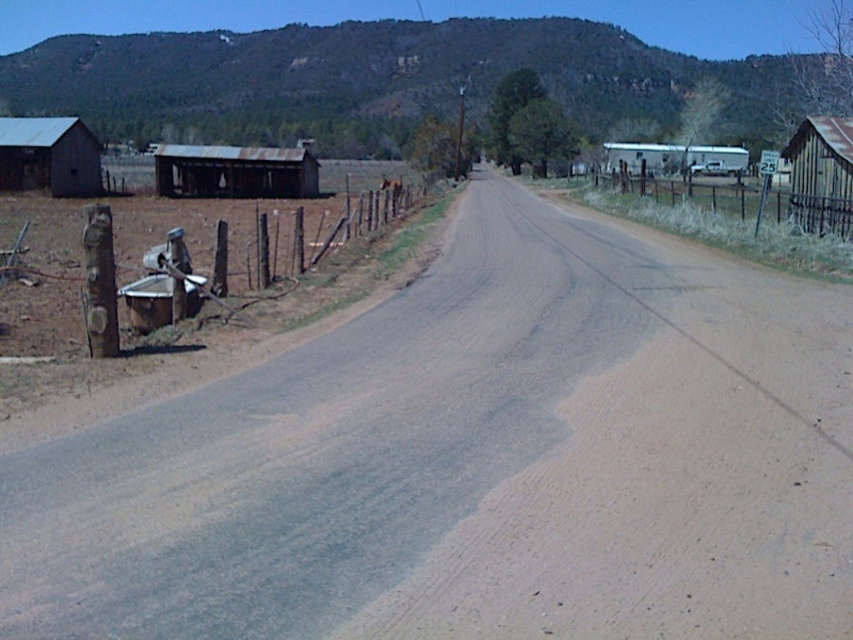
Is rusty metal fence at right shorter than rusty corrugated metal hut at right?

Correct, rusty metal fence at right is not as tall as rusty corrugated metal hut at right.

This screenshot has width=853, height=640. What do you see at coordinates (717, 209) in the screenshot? I see `rusty metal fence at right` at bounding box center [717, 209].

Where is `rusty metal fence at right`? This screenshot has width=853, height=640. rusty metal fence at right is located at coordinates (717, 209).

Identify the location of rusty metal fence at right. The width and height of the screenshot is (853, 640). (717, 209).

Is point (724, 128) closer to viewer compared to point (358, 225)?

No, (724, 128) is behind (358, 225).

Identify the location of green grassy hill at upper center. (392, 81).

Does green grassy hill at upper center have a lesser width compared to rustic wood cabin at left?

Incorrect, green grassy hill at upper center's width is not less than rustic wood cabin at left's.

Can you confirm if green grassy hill at upper center is positioned below rustic wood cabin at left?

No.

The image size is (853, 640). What do you see at coordinates (392, 81) in the screenshot?
I see `green grassy hill at upper center` at bounding box center [392, 81].

Where is `green grassy hill at upper center`? The width and height of the screenshot is (853, 640). green grassy hill at upper center is located at coordinates (392, 81).